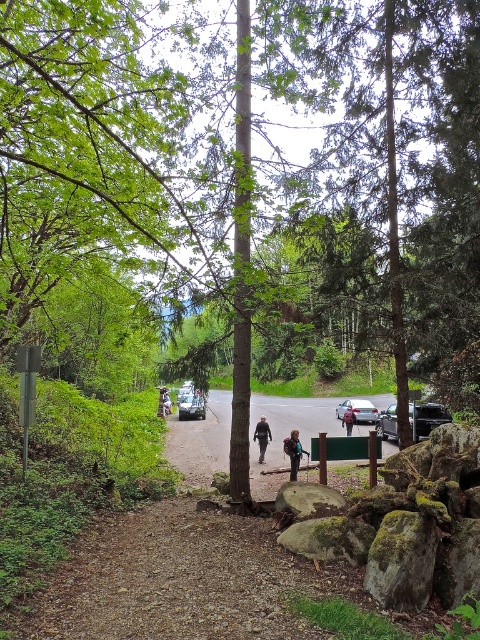
You are standing on the dirt path in the forest and notice a metallic silver car at center and a dark blue jacket at center. Which object appears narrower when viewed from your perspective?

The metallic silver car at center appears narrower than the dark blue jacket at center because the metallic silver car at center is thinner than the dark blue jacket at center.